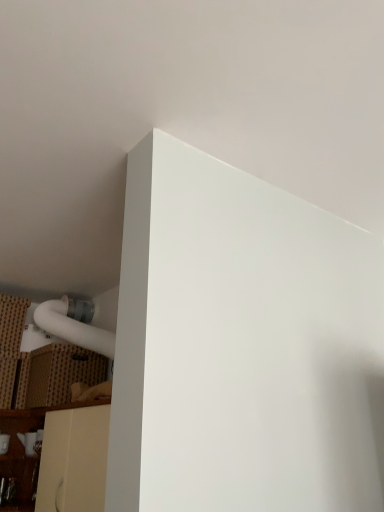
What do you see at coordinates (57, 374) in the screenshot?
I see `brown woven cardboard at lower left` at bounding box center [57, 374].

I want to click on brown woven cardboard at lower left, so click(57, 374).

You are a GUI agent. You are given a task and a screenshot of the screen. Output one action in this format:
    pyautogui.click(x=<x>, y=<y>)
    Task: Click on the brown woven cardboard at lower left
    
    Given the screenshot: What is the action you would take?
    pyautogui.click(x=57, y=374)